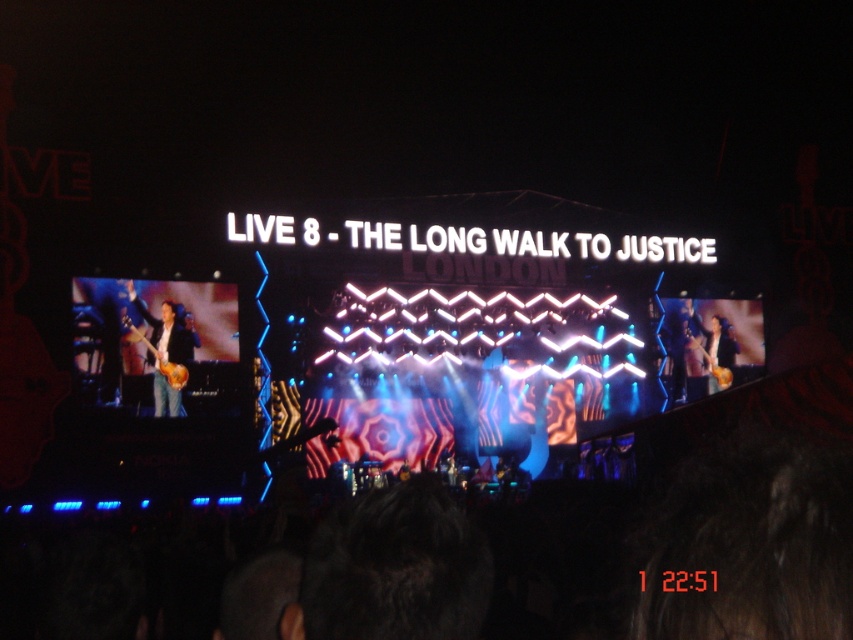
Question: Is glossy wood guitar at center positioned in front of glossy wood guitar at right?

Choices:
 (A) yes
 (B) no

Answer: (A)

Question: Which is nearer to the matte brown guitar at left?

Choices:
 (A) matte brown guitar at right
 (B) glossy wood guitar at center

Answer: (B)

Question: Is matte brown guitar at left below matte brown guitar at right?

Choices:
 (A) yes
 (B) no

Answer: (B)

Question: Based on their relative distances, which object is nearer to the matte brown guitar at right?

Choices:
 (A) glossy wood guitar at center
 (B) glossy wood guitar at right
 (C) matte brown guitar at left

Answer: (B)

Question: Considering the relative positions of matte brown guitar at left and glossy wood guitar at center in the image provided, where is matte brown guitar at left located with respect to glossy wood guitar at center?

Choices:
 (A) above
 (B) below

Answer: (A)

Question: Which point appears closest to the camera in this image?

Choices:
 (A) (686, 326)
 (B) (146, 340)
 (C) (175, 352)

Answer: (B)